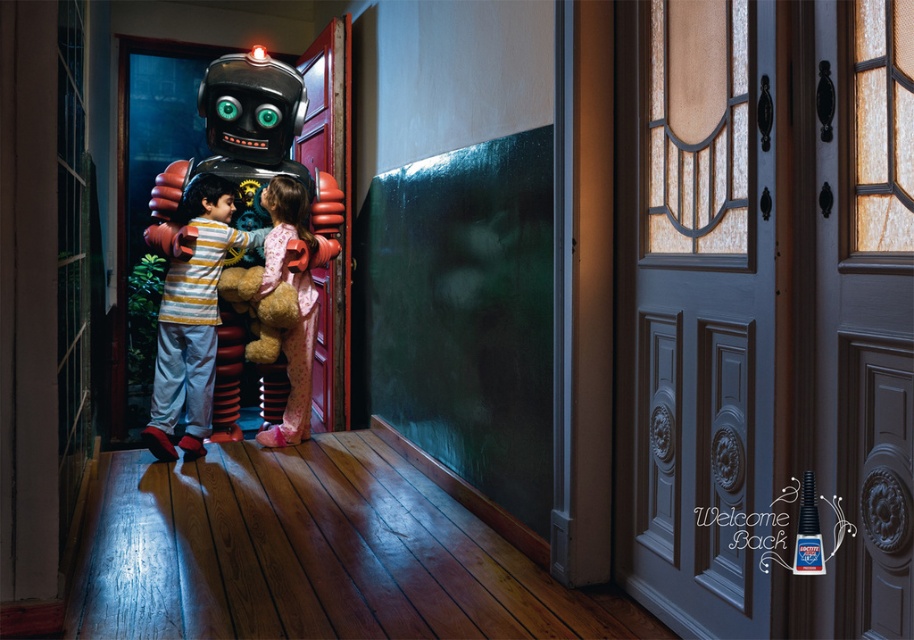
Can you confirm if striped cotton shirt at center is thinner than pink satin pajamas at center?

In fact, striped cotton shirt at center might be wider than pink satin pajamas at center.

Between point (197, 225) and point (278, 268), which one is positioned in front?

Positioned in front is point (197, 225).

Measure the distance between striped cotton shirt at center and camera.

They are 3.58 meters apart.

Image resolution: width=914 pixels, height=640 pixels. What are the coordinates of `striped cotton shirt at center` in the screenshot? It's located at (192, 317).

Does point (294, 323) come in front of point (231, 232)?

No, (294, 323) is behind (231, 232).

Does shiny metallic robot at center have a greater width compared to striped cotton shirt at center?

Indeed, shiny metallic robot at center has a greater width compared to striped cotton shirt at center.

Is point (181, 221) positioned after point (197, 417)?

Yes, it is behind point (197, 417).

The width and height of the screenshot is (914, 640). What are the coordinates of `shiny metallic robot at center` in the screenshot? It's located at (251, 228).

Who is positioned more to the left, striped cotton shirt at center or soft plush teddy bear at center?

From the viewer's perspective, striped cotton shirt at center appears more on the left side.

Is striped cotton shirt at center above soft plush teddy bear at center?

Actually, striped cotton shirt at center is below soft plush teddy bear at center.

Measure the distance between point [206,436] and camera.

A distance of 3.87 meters exists between point [206,436] and camera.

Locate an element on the screen. striped cotton shirt at center is located at coordinates (192, 317).